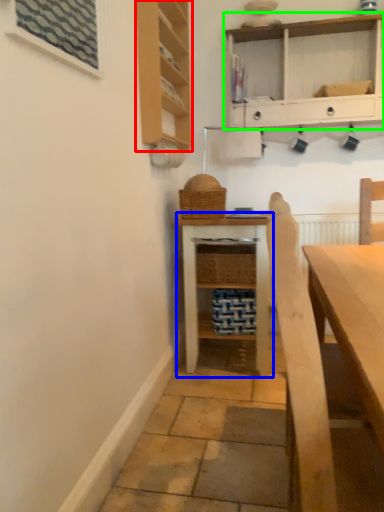
Question: Which object is the closest to the cabinetry (highlighted by a red box)? Choose among these: shelf (highlighted by a blue box) or shelf (highlighted by a green box).

Choices:
 (A) shelf
 (B) shelf

Answer: (B)